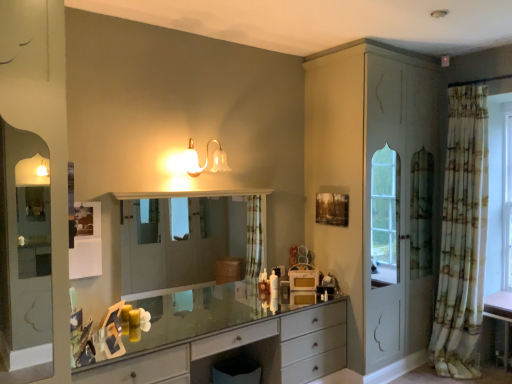
Question: Could you tell me if printed fabric curtain at right is turned towards translucent glass sconce at upper center?

Choices:
 (A) no
 (B) yes

Answer: (A)

Question: Considering the relative sizes of printed fabric curtain at right and translucent glass sconce at upper center in the image provided, is printed fabric curtain at right shorter than translucent glass sconce at upper center?

Choices:
 (A) no
 (B) yes

Answer: (A)

Question: Can you confirm if printed fabric curtain at right is smaller than translucent glass sconce at upper center?

Choices:
 (A) no
 (B) yes

Answer: (A)

Question: Considering the relative positions of printed fabric curtain at right and translucent glass sconce at upper center in the image provided, is printed fabric curtain at right to the right of translucent glass sconce at upper center from the viewer's perspective?

Choices:
 (A) yes
 (B) no

Answer: (A)

Question: From the image's perspective, does printed fabric curtain at right appear higher than translucent glass sconce at upper center?

Choices:
 (A) no
 (B) yes

Answer: (A)

Question: Is printed fabric curtain at right looking in the opposite direction of translucent glass sconce at upper center?

Choices:
 (A) yes
 (B) no

Answer: (B)

Question: Is clear glass mirror at center positioned beyond the bounds of printed fabric curtain at right?

Choices:
 (A) yes
 (B) no

Answer: (A)

Question: Is clear glass mirror at center to the right of printed fabric curtain at right from the viewer's perspective?

Choices:
 (A) no
 (B) yes

Answer: (A)

Question: From the image's perspective, is clear glass mirror at center below printed fabric curtain at right?

Choices:
 (A) no
 (B) yes

Answer: (B)

Question: Can you confirm if clear glass mirror at center is shorter than printed fabric curtain at right?

Choices:
 (A) no
 (B) yes

Answer: (B)

Question: From the image's perspective, does clear glass mirror at center appear higher than printed fabric curtain at right?

Choices:
 (A) no
 (B) yes

Answer: (A)

Question: Is clear glass mirror at center positioned behind printed fabric curtain at right?

Choices:
 (A) yes
 (B) no

Answer: (B)

Question: From the image's perspective, is printed fabric curtain at right below matte gray chest of drawers at center?

Choices:
 (A) yes
 (B) no

Answer: (B)